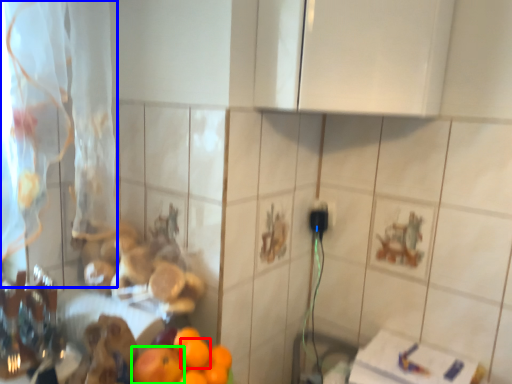
Question: Which object is the farthest from orange (highlighted by a red box)? Choose among these: curtain (highlighted by a blue box) or orange (highlighted by a green box).

Choices:
 (A) curtain
 (B) orange

Answer: (A)